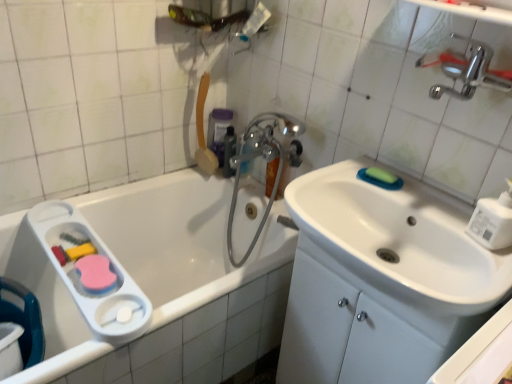
Find the location of a particular element. Image resolution: width=512 pixels, height=384 pixels. vacant space situated on the left part of white plastic soap dispenser at right is located at coordinates (433, 226).